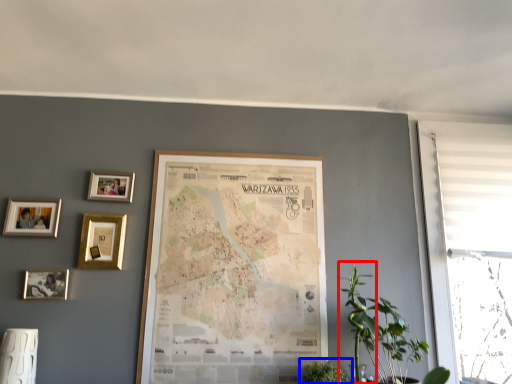
Question: Which point is closer to the camera, plant (highlighted by a red box) or houseplant (highlighted by a blue box)?

Choices:
 (A) plant
 (B) houseplant

Answer: (A)